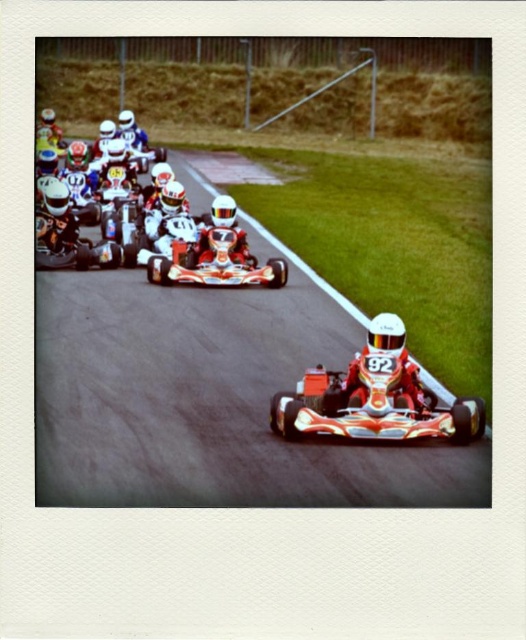
You are a spectator at the karting race. You see the shiny red helmet at center and the white glossy number at center. Which object is closer to you?

The shiny red helmet at center is closer to you because it is further to the viewer than the white glossy number at center.